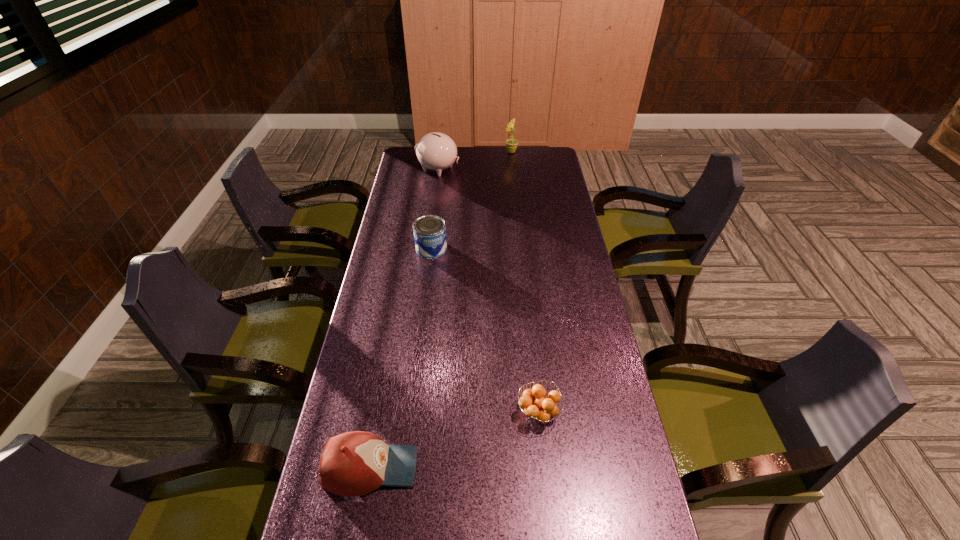
Locate an element on the screen. This screenshot has width=960, height=540. vacant space located 0.260m on the front label of the third nearest object is located at coordinates (423, 312).

The width and height of the screenshot is (960, 540). I want to click on vacant space located 0.240m on the front-facing side of the nearest object, so click(x=516, y=467).

You are a GUI agent. You are given a task and a screenshot of the screen. Output one action in this format:
    pyautogui.click(x=<x>, y=<y>)
    Task: Click on the blank space located on the left of the orange fruit
    This screenshot has width=960, height=540.
    Given the screenshot: What is the action you would take?
    pyautogui.click(x=476, y=412)

Locate an element on the screen. The height and width of the screenshot is (540, 960). sunflower at the far edge is located at coordinates (511, 144).

The width and height of the screenshot is (960, 540). Identify the location of piggy bank situated at the far edge. (436, 151).

At what (x,y) coordinates should I click in order to perform the action: click on piggy bank that is positioned at the left edge. Please return your answer as a coordinate pair (x, y). The image size is (960, 540). Looking at the image, I should click on pyautogui.click(x=436, y=151).

Locate an element on the screen. can present at the left edge is located at coordinates (429, 230).

You are a GUI agent. You are given a task and a screenshot of the screen. Output one action in this format:
    pyautogui.click(x=<x>, y=<y>)
    Task: Click on the baseball cap situated at the left edge
    
    Given the screenshot: What is the action you would take?
    pyautogui.click(x=356, y=463)

This screenshot has width=960, height=540. I want to click on object situated at the right edge, so click(x=540, y=408).

The width and height of the screenshot is (960, 540). I want to click on object at the far left corner, so click(x=436, y=151).